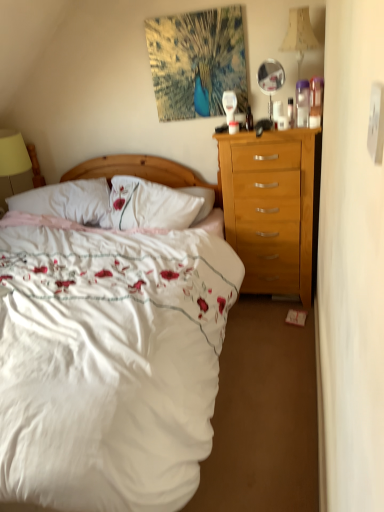
Question: From the image's perspective, is translucent plastic bottle at upper center, positioned as the 1th bottle in left-to-right order, above yellow fabric lampshade at left, which is the second lamp from right to left?

Choices:
 (A) yes
 (B) no

Answer: (A)

Question: Would you say translucent plastic bottle at upper center, arranged as the second bottle when viewed from the right, is a long distance from yellow fabric lampshade at left, marked as the second lamp in a front-to-back arrangement?

Choices:
 (A) no
 (B) yes

Answer: (B)

Question: Is translucent plastic bottle at upper center, positioned as the 1th bottle in left-to-right order, taller than yellow fabric lampshade at left, the 1th lamp in the bottom-to-top sequence?

Choices:
 (A) yes
 (B) no

Answer: (B)

Question: Is translucent plastic bottle at upper center, arranged as the second bottle when viewed from the right, wider than yellow fabric lampshade at left, placed as the second lamp when sorted from top to bottom?

Choices:
 (A) no
 (B) yes

Answer: (A)

Question: From a real-world perspective, is translucent plastic bottle at upper center, which is the 2th bottle in front-to-back order, physically above yellow fabric lampshade at left, marked as the second lamp in a front-to-back arrangement?

Choices:
 (A) no
 (B) yes

Answer: (B)

Question: Is point coord(167,404) positioned closer to the camera than point coord(309,29)?

Choices:
 (A) closer
 (B) farther

Answer: (A)

Question: Is white satin bed at center bigger or smaller than beige fabric lampshade at upper right, which ranks as the second lamp in back-to-front order?

Choices:
 (A) small
 (B) big

Answer: (B)

Question: Is white satin bed at center taller or shorter than beige fabric lampshade at upper right, which is counted as the second lamp, starting from the left?

Choices:
 (A) tall
 (B) short

Answer: (A)

Question: Choose the correct answer: Is white satin bed at center inside beige fabric lampshade at upper right, which ranks as the second lamp in back-to-front order, or outside it?

Choices:
 (A) inside
 (B) outside

Answer: (B)

Question: From the image's perspective, is clear glass mirror at upper right above or below white satin bed at center?

Choices:
 (A) below
 (B) above

Answer: (B)

Question: From a real-world perspective, is clear glass mirror at upper right positioned above or below white satin bed at center?

Choices:
 (A) below
 (B) above

Answer: (B)

Question: Choose the correct answer: Is clear glass mirror at upper right inside white satin bed at center or outside it?

Choices:
 (A) outside
 (B) inside

Answer: (A)

Question: Considering the positions of clear glass mirror at upper right and white satin bed at center in the image, is clear glass mirror at upper right taller or shorter than white satin bed at center?

Choices:
 (A) short
 (B) tall

Answer: (A)

Question: Is matte white coffee cup at center in front of or behind white soft pillow at center in the image?

Choices:
 (A) behind
 (B) front

Answer: (B)

Question: From the image's perspective, is matte white coffee cup at center positioned above or below white soft pillow at center?

Choices:
 (A) below
 (B) above

Answer: (B)